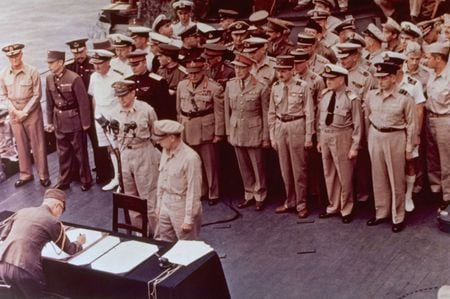
Locate an element on the screen. chair is located at coordinates (114, 200).